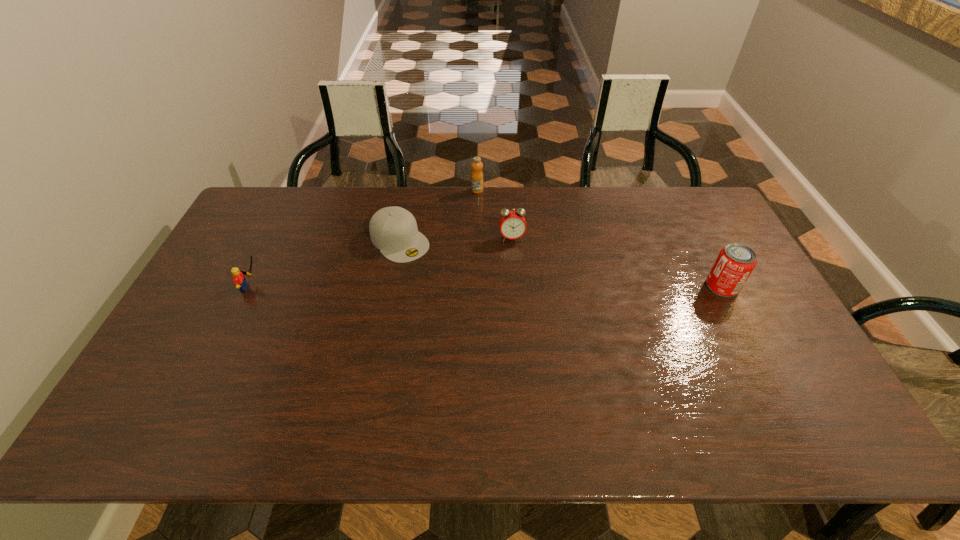
I want to click on object present at the left edge, so click(x=239, y=280).

I want to click on object that is at the right edge, so click(735, 262).

This screenshot has height=540, width=960. In the image, there is a desktop. In order to click on vacant area at the far edge in this screenshot , I will do coord(648,206).

This screenshot has width=960, height=540. In the image, there is a desktop. Identify the location of vacant region at the near edge. (635, 378).

This screenshot has width=960, height=540. I want to click on vacant space at the left edge, so click(x=236, y=301).

In the image, there is a desktop. At what (x,y) coordinates should I click in order to perform the action: click on vacant area at the near left corner. Please return your answer as a coordinate pair (x, y). The width and height of the screenshot is (960, 540). Looking at the image, I should click on (156, 377).

Identify the location of empty space that is in between the orange juice and the alarm clock. The image size is (960, 540). (494, 214).

The image size is (960, 540). I want to click on unoccupied area between the can and the orange juice, so click(600, 239).

Find the location of a particular element. The height and width of the screenshot is (540, 960). free space that is in between the fourth object from left to right and the third object from left to right is located at coordinates (494, 214).

Identify the location of free point between the third object from right to left and the can. (600, 239).